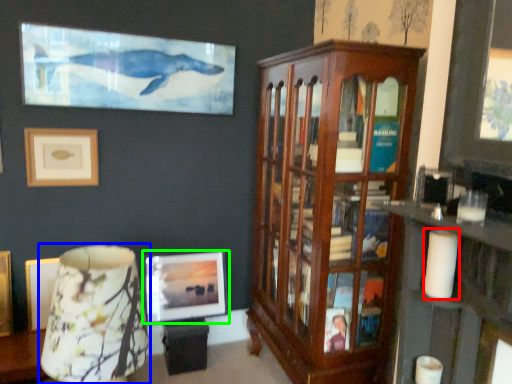
Question: Which object is positioned closest to candle (highlighted by a red box)? Select from table lamp (highlighted by a blue box) and picture frame (highlighted by a green box).

Choices:
 (A) table lamp
 (B) picture frame

Answer: (A)